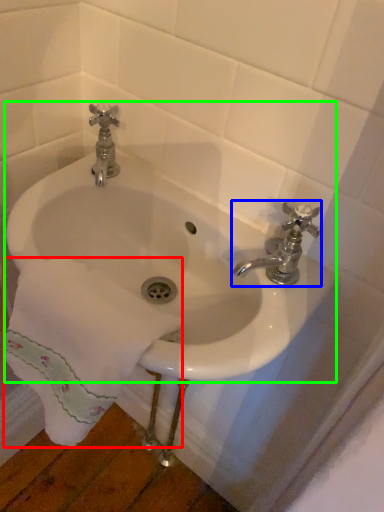
Question: Estimate the real-world distances between objects in this image. Which object is closer to bath towel (highlighted by a red box), tap (highlighted by a blue box) or sink (highlighted by a green box)?

Choices:
 (A) tap
 (B) sink

Answer: (B)